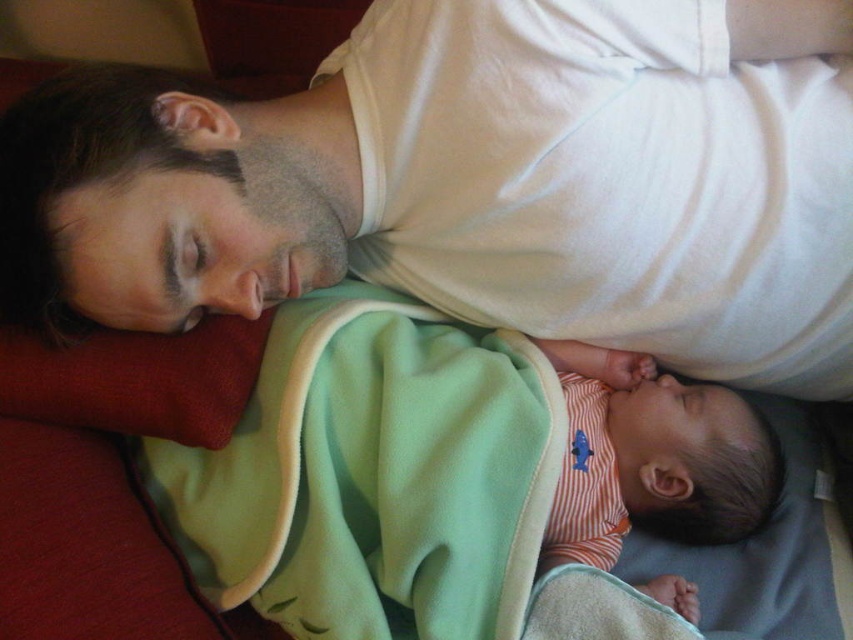
Who is taller, white cotton shirt at upper center or orange striped fabric at center?

With more height is white cotton shirt at upper center.

The width and height of the screenshot is (853, 640). What do you see at coordinates (479, 182) in the screenshot?
I see `white cotton shirt at upper center` at bounding box center [479, 182].

I want to click on white cotton shirt at upper center, so click(479, 182).

The width and height of the screenshot is (853, 640). Find the location of `white cotton shirt at upper center`. white cotton shirt at upper center is located at coordinates (479, 182).

Can you confirm if white cotton shirt at upper center is positioned to the right of orange striped fabric at lower center?

Correct, you'll find white cotton shirt at upper center to the right of orange striped fabric at lower center.

Does point (218, 189) come closer to viewer compared to point (643, 486)?

Yes, it is.

Image resolution: width=853 pixels, height=640 pixels. I want to click on white cotton shirt at upper center, so point(479,182).

Is point (440, 500) farther from viewer compared to point (692, 508)?

No, it is in front of (692, 508).

Who is more distant from viewer, (335,323) or (637,396)?

The point (637,396) is more distant.

Locate an element on the screen. The width and height of the screenshot is (853, 640). orange striped fabric at lower center is located at coordinates (440, 472).